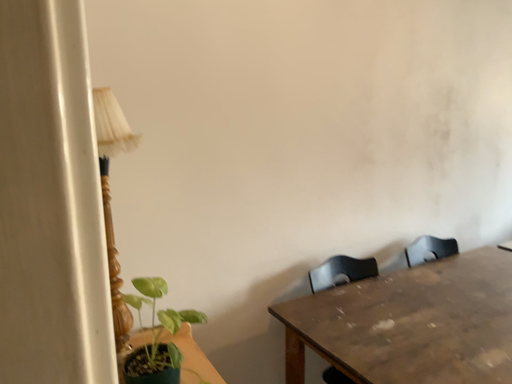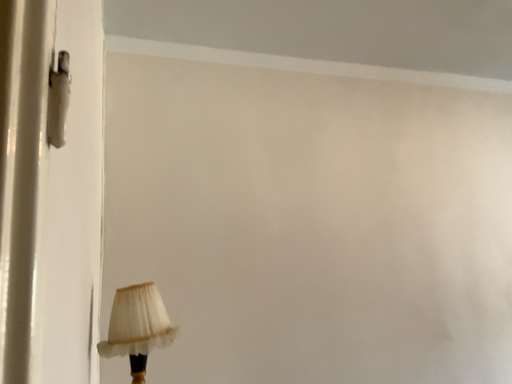
Question: Which way did the camera rotate in the video?

Choices:
 (A) rotated left
 (B) rotated right

Answer: (A)